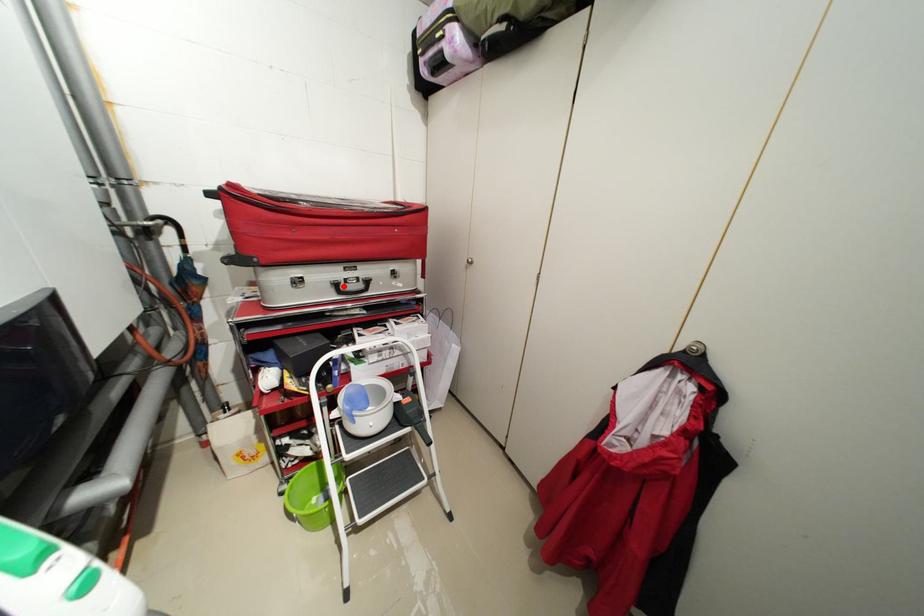
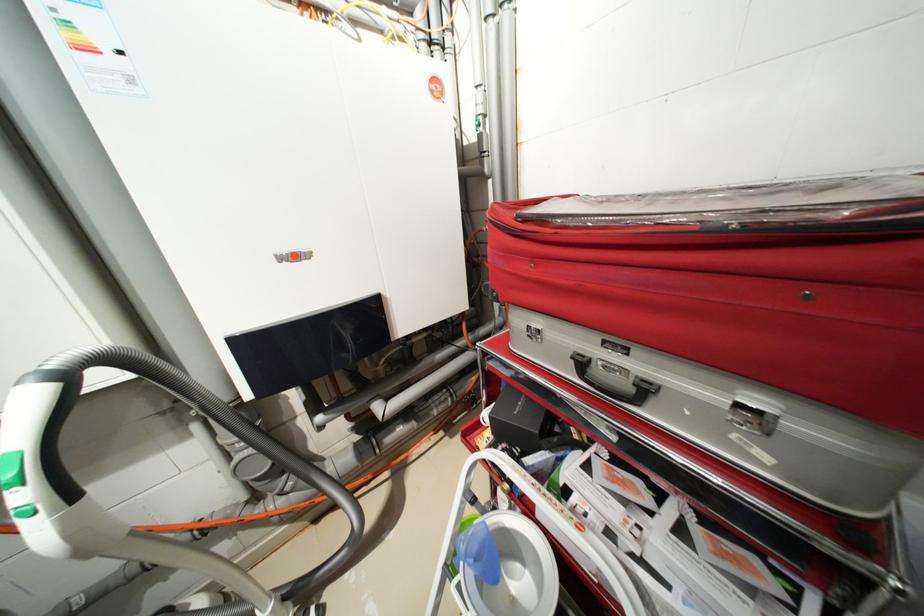
Locate, in the second image, the point that corresponds to the highlighted location in the first image.

(589, 363)